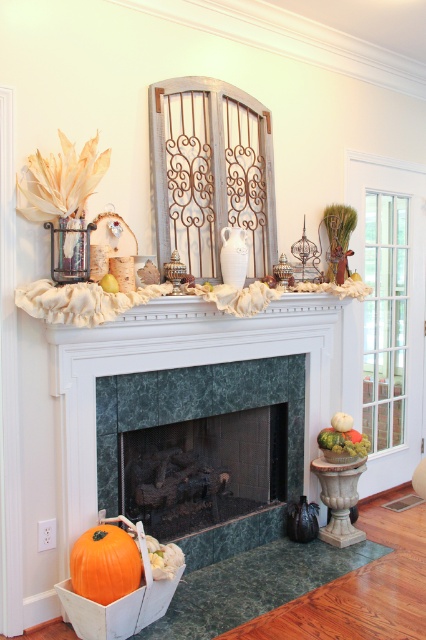
Can you confirm if green marble fireplace at center is smaller than orange matte pumpkin at lower left?

No.

Is point (253, 397) closer to viewer compared to point (108, 589)?

That is False.

Identify the location of green marble fireplace at center. This screenshot has height=640, width=426. (195, 406).

Find the location of a particular element. green marble fireplace at center is located at coordinates (195, 406).